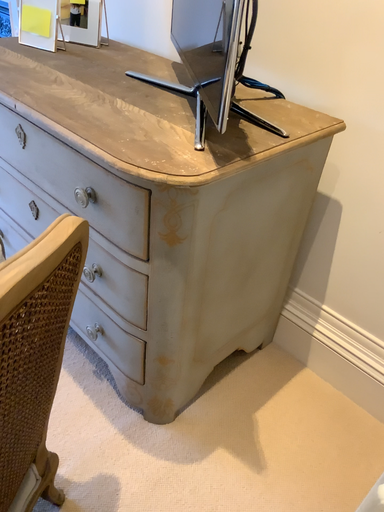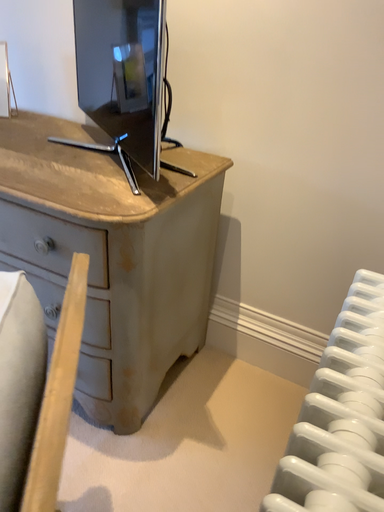
Question: How did the camera likely rotate when shooting the video?

Choices:
 (A) rotated upward
 (B) rotated downward

Answer: (A)